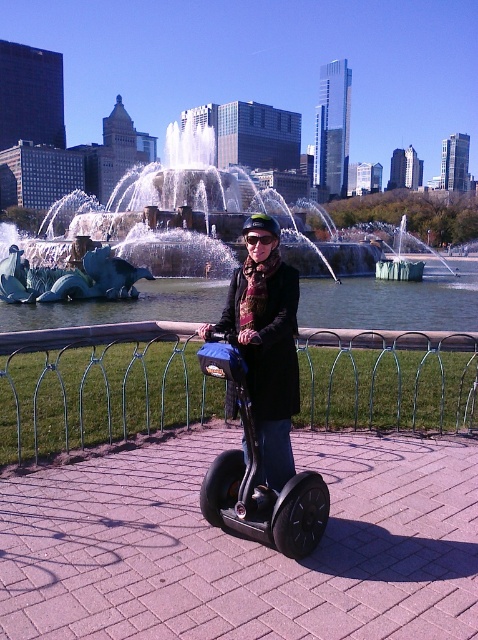
You are a delivery person on a Segway and need to deliver a package to a customer. You are currently on the matte black segway at center. There is a metal wire fence at lower center. To ensure safety, you need to maintain a distance of at least 10 feet from any obstacles. Is your current position safe?

The metal wire fence at lower center is 9.50 feet from the matte black segway at center. Since the required safety distance is 10 feet, the current position is not safe as it is 0.5 feet too close.

You are standing at the center of the image and want to reach the metal wire fence at lower center. Which direction should you move to reach it?

You should move downward to reach the metal wire fence at lower center since it is located at lower center.

You are planning to place a new bench in the park. The bench requires a space wider than the metal wire fence at lower center. Can the polished stone fountain at center provide enough width for the bench?

The metal wire fence at lower center is narrower than the polished stone fountain at center, so the polished stone fountain at center has sufficient width to accommodate the bench.